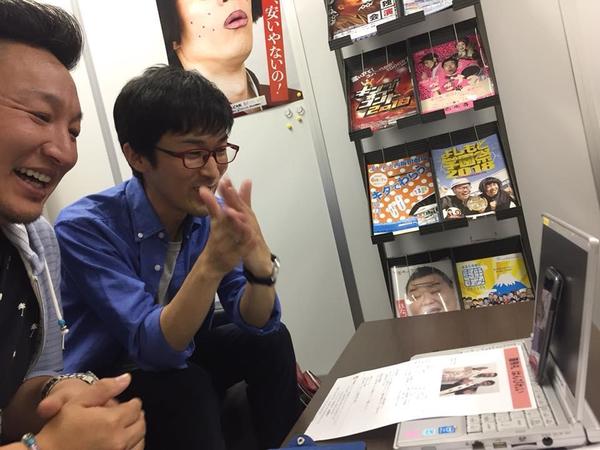
In order to click on laptop in this screenshot , I will do (518, 421).